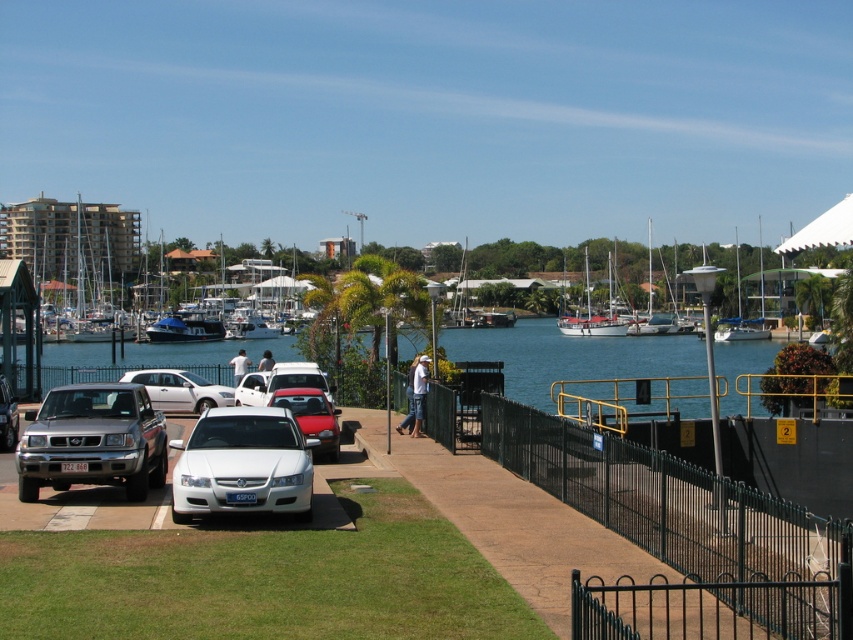
You are planning to park your car in the parking lot near the waterfront. You see the matte white car at center and the white wooden sailboat at center. Which vehicle takes up more space in the parking area?

The white wooden sailboat at center takes up more space than the matte white car at center because the matte white car at center occupies less space than white wooden sailboat at center.

You are a delivery person trying to load a package onto the white glossy boat at center and the silver metallic suv at center left. Which one requires a taller loading ramp?

The white glossy boat at center requires a taller loading ramp because it is taller than the silver metallic suv at center left.